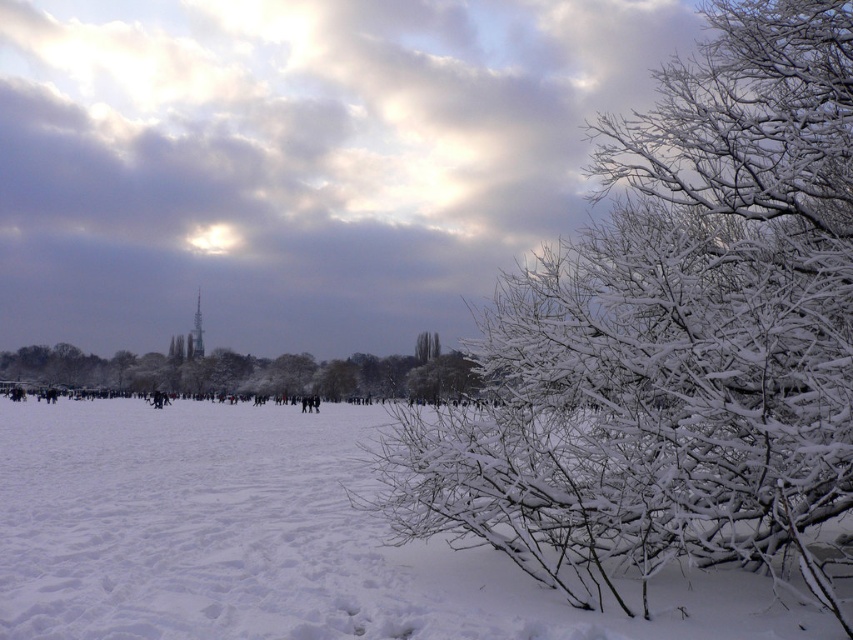
Question: Among these points, which one is nearest to the camera?

Choices:
 (A) (393, 388)
 (B) (553, 582)

Answer: (B)

Question: Can you confirm if white frosty branches at lower right is thinner than white frosty branches at center?

Choices:
 (A) no
 (B) yes

Answer: (B)

Question: Is white frosty branches at center right above white frosty branches at center?

Choices:
 (A) yes
 (B) no

Answer: (A)

Question: Among these objects, which one is farthest from the camera?

Choices:
 (A) white frosty branches at center
 (B) white frosty branches at lower right

Answer: (A)

Question: Among these objects, which one is farthest from the camera?

Choices:
 (A) white frosty branches at lower right
 (B) white frosty branches at center right
 (C) white frosty branches at center

Answer: (C)

Question: Is white frosty branches at center right in front of white frosty branches at lower right?

Choices:
 (A) yes
 (B) no

Answer: (A)